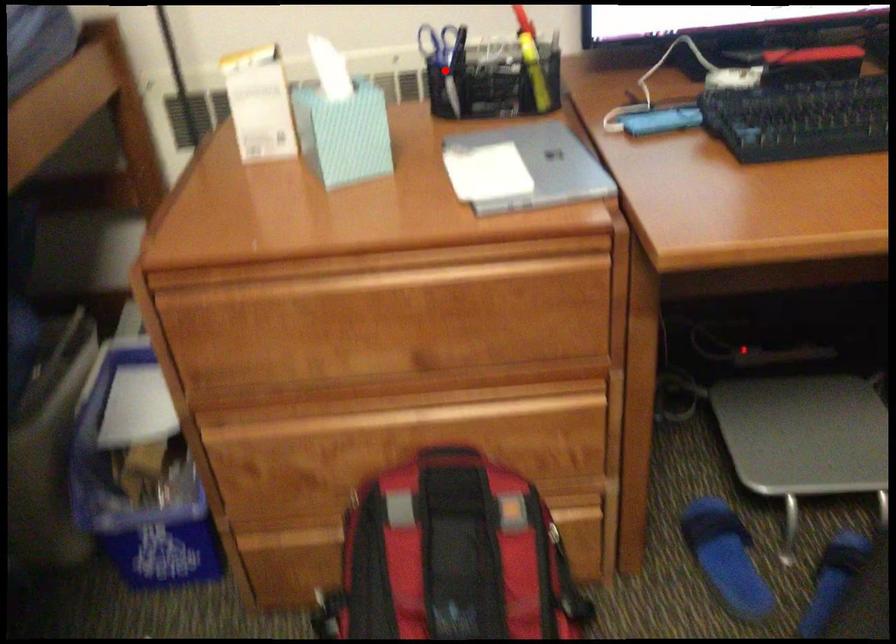
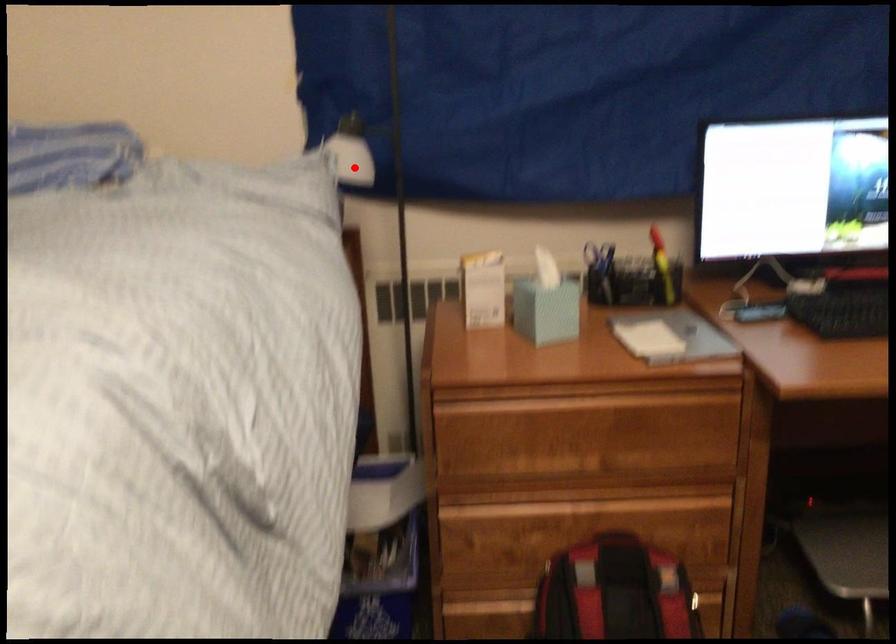
I am providing you with two images of the same scene from different viewpoints. A red point is marked on the first image and another point is marked on the second image. Does the point marked in image1 correspond to the same location as the one in image2?

No